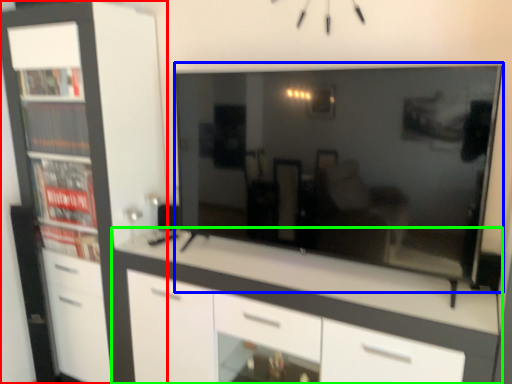
Question: Based on their relative distances, which object is nearer to cabinetry (highlighted by a red box)? Choose from television (highlighted by a blue box) and chest of drawers (highlighted by a green box).

Choices:
 (A) television
 (B) chest of drawers

Answer: (B)